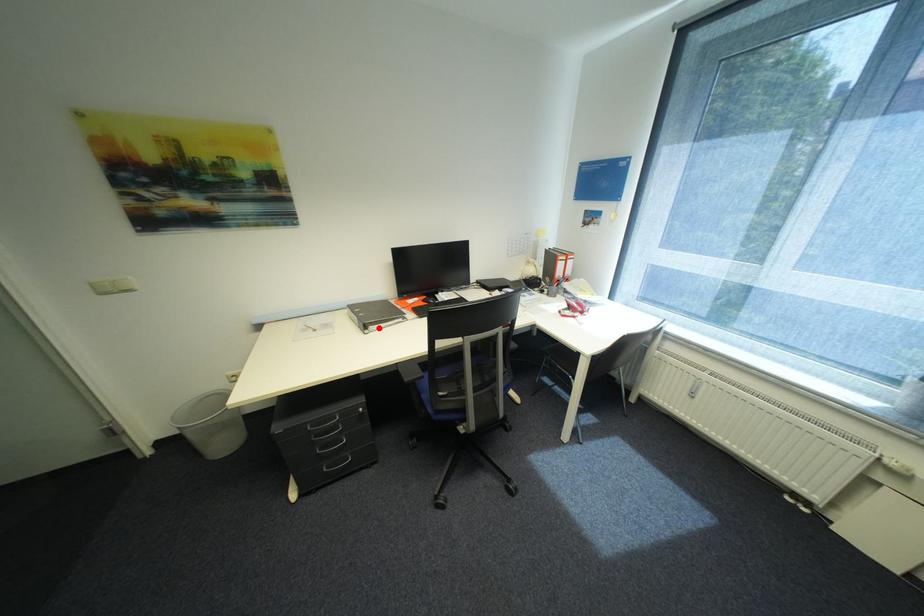
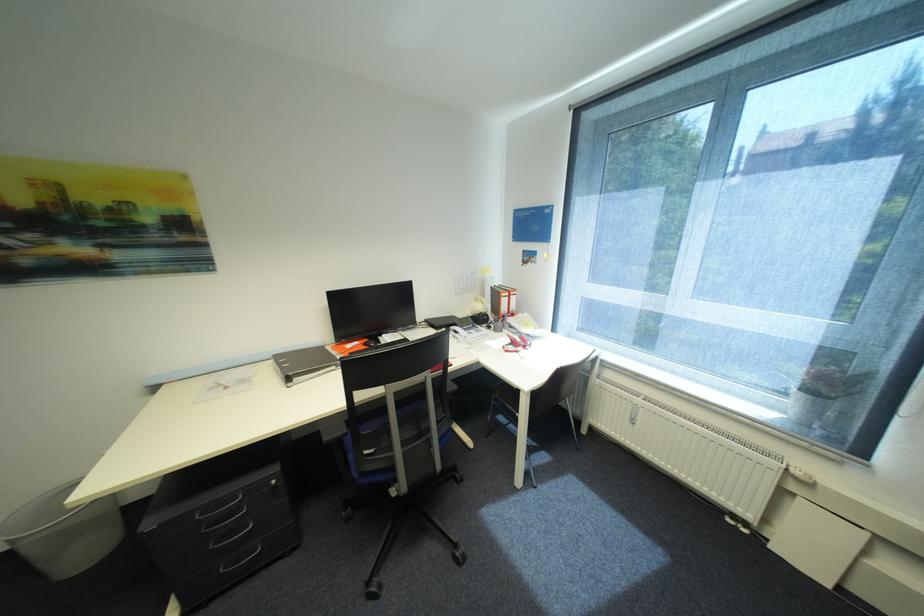
The point at the highlighted location is marked in the first image. Where is the corresponding point in the second image?

(304, 379)